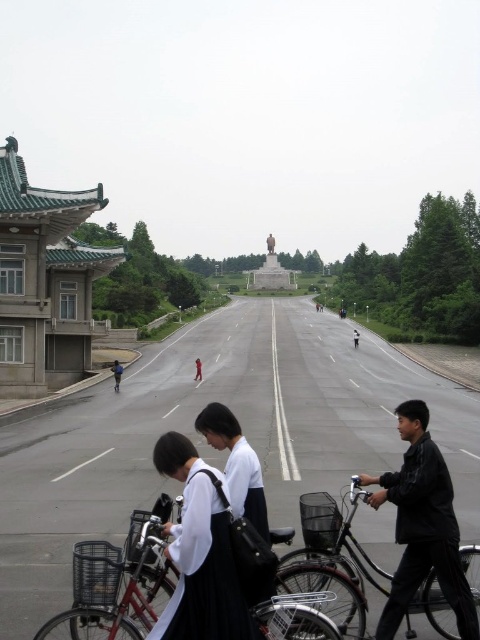
The width and height of the screenshot is (480, 640). Describe the element at coordinates (116, 582) in the screenshot. I see `silver metallic bicycle at lower center` at that location.

How much distance is there between silver metallic bicycle at lower center and red fabric person at center?

silver metallic bicycle at lower center and red fabric person at center are 115.21 feet apart from each other.

Locate an element on the screen. The image size is (480, 640). silver metallic bicycle at lower center is located at coordinates (116, 582).

Image resolution: width=480 pixels, height=640 pixels. In order to click on silver metallic bicycle at lower center in this screenshot , I will do `click(116, 582)`.

Who is taller, silver metallic bicycle at lower center or black matte bicycle at lower right?

With more height is black matte bicycle at lower right.

Is silver metallic bicycle at lower center above black matte bicycle at lower right?

Incorrect, silver metallic bicycle at lower center is not positioned above black matte bicycle at lower right.

The height and width of the screenshot is (640, 480). I want to click on silver metallic bicycle at lower center, so click(116, 582).

This screenshot has height=640, width=480. What are the coordinates of `silver metallic bicycle at lower center` in the screenshot? It's located at (116, 582).

Can you confirm if white matte uniform at lower center is shorter than black matte bicycle at lower right?

No, white matte uniform at lower center is not shorter than black matte bicycle at lower right.

Based on the photo, can you confirm if white matte uniform at lower center is wider than black matte bicycle at lower right?

In fact, white matte uniform at lower center might be narrower than black matte bicycle at lower right.

The height and width of the screenshot is (640, 480). What do you see at coordinates (200, 554) in the screenshot?
I see `white matte uniform at lower center` at bounding box center [200, 554].

You are a GUI agent. You are given a task and a screenshot of the screen. Output one action in this format:
    pyautogui.click(x=<x>, y=<y>)
    Task: Click on the white matte uniform at lower center
    The height and width of the screenshot is (640, 480).
    Given the screenshot: What is the action you would take?
    pyautogui.click(x=200, y=554)